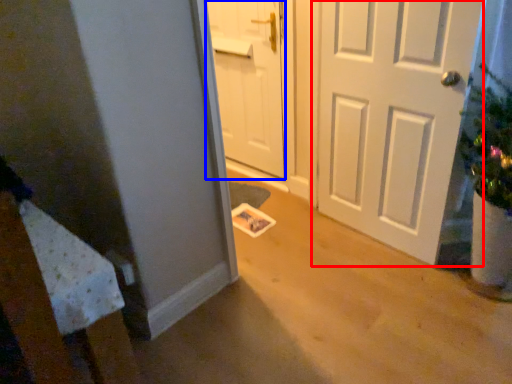
Question: Which object is further to the camera taking this photo, door (highlighted by a red box) or door (highlighted by a blue box)?

Choices:
 (A) door
 (B) door

Answer: (B)